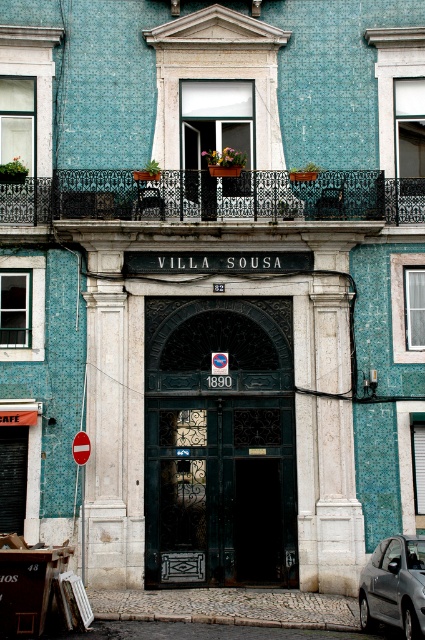
Question: Is dark green wrought iron door at center thinner than black wrought iron balcony at upper center?

Choices:
 (A) no
 (B) yes

Answer: (B)

Question: Which object appears closest to the camera in this image?

Choices:
 (A) dark green wrought iron door at center
 (B) metallic gray car at lower right
 (C) black wrought iron balcony at upper center

Answer: (B)

Question: Is dark green wrought iron door at center to the right of black wrought iron balcony at upper center from the viewer's perspective?

Choices:
 (A) yes
 (B) no

Answer: (B)

Question: Which point is farther from the camera taking this photo?

Choices:
 (A) (359, 602)
 (B) (173, 528)
 (C) (184, 188)

Answer: (C)

Question: Which of the following is the closest to the observer?

Choices:
 (A) metallic gray car at lower right
 (B) dark green wrought iron door at center

Answer: (A)

Question: Is black wrought iron balcony at upper center above metallic gray car at lower right?

Choices:
 (A) yes
 (B) no

Answer: (A)